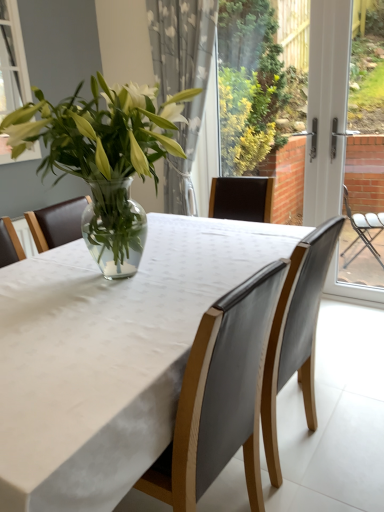
Question: Does leather chair at center, the 1th chair in the right-to-left sequence, have a smaller size compared to white sheer curtain at upper center?

Choices:
 (A) no
 (B) yes

Answer: (B)

Question: Is leather chair at center, the second chair viewed from the left, to the left of white sheer curtain at upper center from the viewer's perspective?

Choices:
 (A) yes
 (B) no

Answer: (B)

Question: From a real-world perspective, is leather chair at center, the second chair viewed from the left, physically above white sheer curtain at upper center?

Choices:
 (A) yes
 (B) no

Answer: (B)

Question: From the image's perspective, is leather chair at center, the second chair viewed from the left, beneath white sheer curtain at upper center?

Choices:
 (A) no
 (B) yes

Answer: (B)

Question: Is white sheer curtain at upper center surrounded by leather chair at center, the second chair viewed from the left?

Choices:
 (A) yes
 (B) no

Answer: (B)

Question: Is leather chair at center, the second chair viewed from the left, turned away from white sheer curtain at upper center?

Choices:
 (A) no
 (B) yes

Answer: (A)

Question: From the image's perspective, is white fabric table at center above white plastic screen door at right?

Choices:
 (A) no
 (B) yes

Answer: (A)

Question: Is there a large distance between white fabric table at center and white plastic screen door at right?

Choices:
 (A) yes
 (B) no

Answer: (A)

Question: Does white fabric table at center have a smaller size compared to white plastic screen door at right?

Choices:
 (A) no
 (B) yes

Answer: (A)

Question: From a real-world perspective, is white fabric table at center on top of white plastic screen door at right?

Choices:
 (A) no
 (B) yes

Answer: (A)

Question: Is white fabric table at center in contact with white plastic screen door at right?

Choices:
 (A) no
 (B) yes

Answer: (A)

Question: Does white fabric table at center have a greater width compared to white plastic screen door at right?

Choices:
 (A) yes
 (B) no

Answer: (A)

Question: Considering the relative sizes of white plastic screen door at right and leather chair at center, the second chair viewed from the left, in the image provided, is white plastic screen door at right taller than leather chair at center, the second chair viewed from the left,?

Choices:
 (A) no
 (B) yes

Answer: (B)